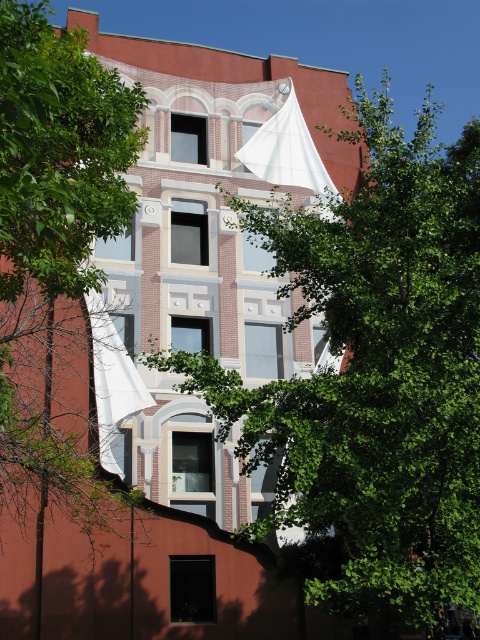
You are standing in front of the building and want to know which object is taller between the green leafy tree at left and the white fabric canopy at upper center. Can you determine which one is taller?

The green leafy tree at left is taller than the white fabric canopy at upper center according to the description.

Based on the scene description, where is the green leafy tree at left located in terms of its 2D coordinates?

The green leafy tree at left is located at the 2D coordinates of point (60, 154).